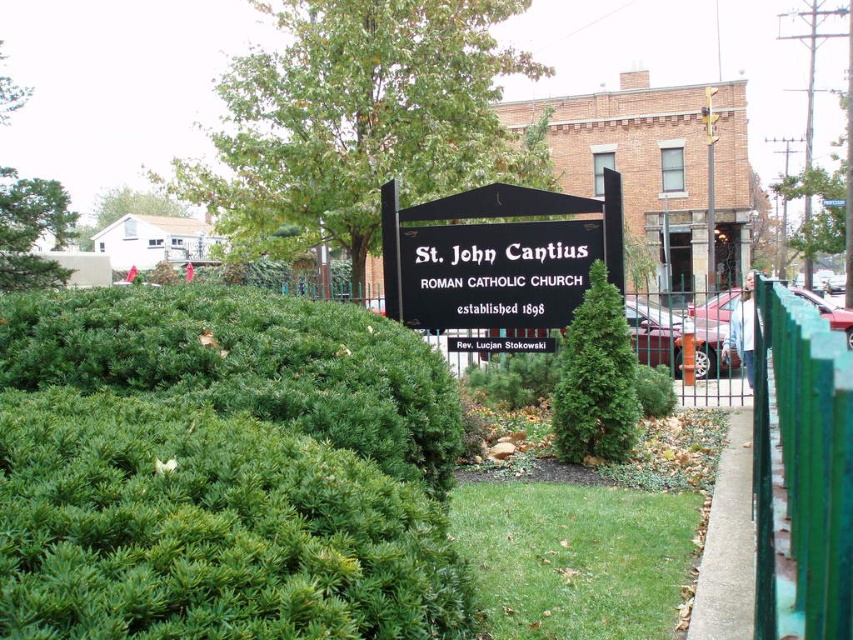
Is point (273, 536) behind point (607, 250)?

No, it is not.

Can you confirm if green leafy hedge at center is taller than black matte sign at center?

In fact, green leafy hedge at center may be shorter than black matte sign at center.

Which is in front, point (276, 600) or point (572, 296)?

Positioned in front is point (276, 600).

Identify the location of green leafy hedge at center. (223, 470).

Is point (415, 326) farther from viewer compared to point (599, 412)?

Yes, point (415, 326) is behind point (599, 412).

Describe the element at coordinates (496, 257) in the screenshot. This screenshot has width=853, height=640. I see `black matte sign at center` at that location.

Locate an element on the screen. Image resolution: width=853 pixels, height=640 pixels. black matte sign at center is located at coordinates (496, 257).

Is green leafy hedge at center taller than green textured bush at center?

No, green leafy hedge at center is not taller than green textured bush at center.

Is point (227, 616) positioned before point (598, 369)?

Yes, it is.

Find the location of a particular element. The width and height of the screenshot is (853, 640). green leafy hedge at center is located at coordinates (223, 470).